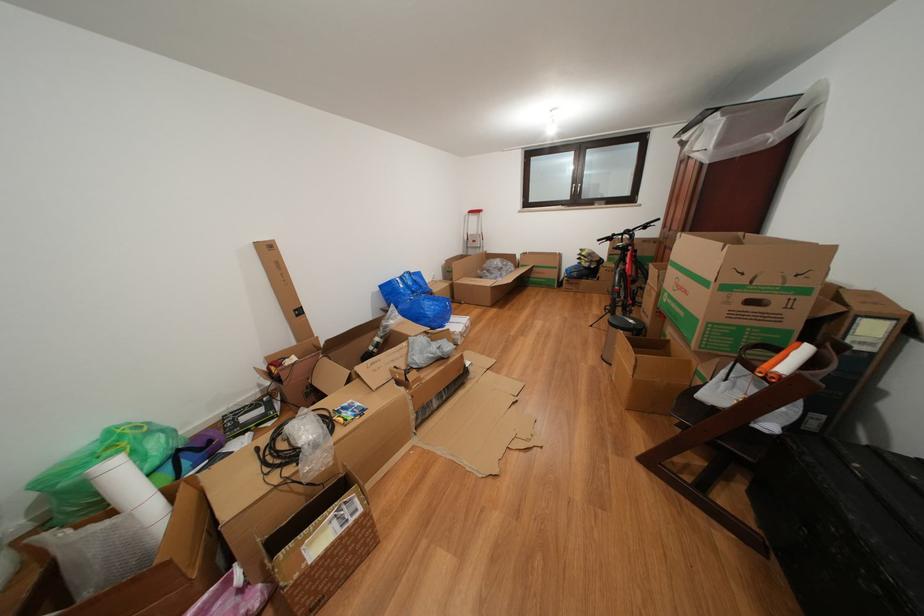
The image size is (924, 616). Find the location of `chair sitting surface`. chair sitting surface is located at coordinates pos(738,398).